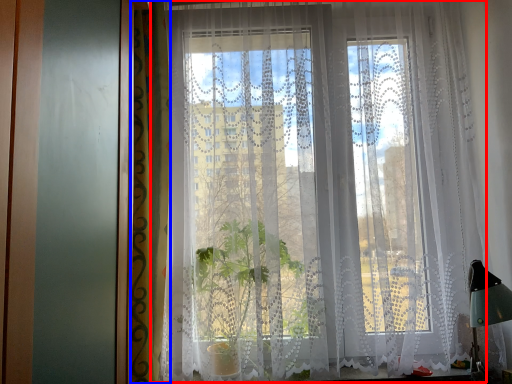
Question: Which point is further to the camera, curtain (highlighted by a red box) or curtain (highlighted by a blue box)?

Choices:
 (A) curtain
 (B) curtain

Answer: (A)